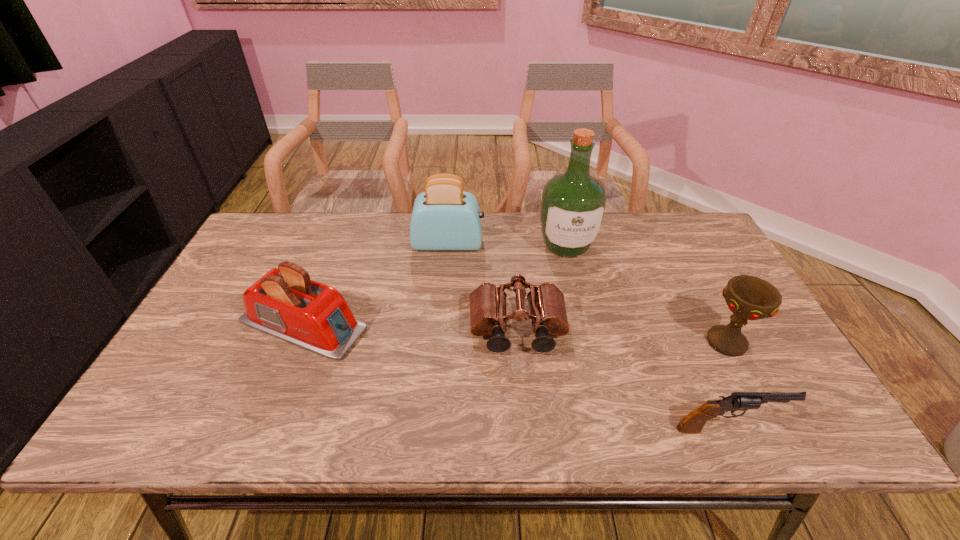
The height and width of the screenshot is (540, 960). I want to click on free space located 0.370m on the right of the shorter toaster, so click(511, 325).

The width and height of the screenshot is (960, 540). Identify the location of vacant space located on the left of the chalice. (648, 342).

At what (x,y) coordinates should I click in order to perform the action: click on free space located along the barrel of the gun. Please return your answer as a coordinate pair (x, y). This screenshot has height=540, width=960. Looking at the image, I should click on (815, 428).

Identify the location of free space located through the eyepieces of the binoculars. This screenshot has width=960, height=540. (523, 401).

This screenshot has width=960, height=540. In order to click on liquor present at the far edge in this screenshot , I will do `click(573, 205)`.

At what (x,y) coordinates should I click in order to perform the action: click on toaster that is at the far edge. Please return your answer as a coordinate pair (x, y). The width and height of the screenshot is (960, 540). Looking at the image, I should click on (444, 217).

Image resolution: width=960 pixels, height=540 pixels. I want to click on object that is at the near edge, so click(x=692, y=423).

Where is `object that is at the left edge`? object that is at the left edge is located at coordinates (285, 303).

Find the location of a particular element. chalice that is at the right edge is located at coordinates (750, 298).

The height and width of the screenshot is (540, 960). What are the coordinates of `gun that is at the right edge` in the screenshot? It's located at (692, 423).